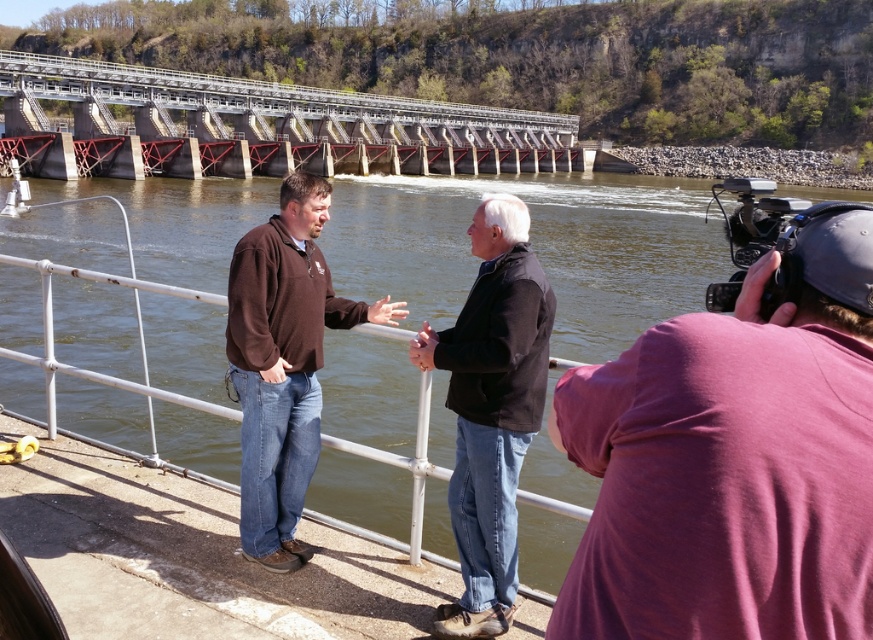
You are a photographer trying to capture a portrait of both the black matte jacket at center and the brown fleece at center. Since you want both subjects to be in focus, you need to adjust your camera settings. Considering their heights, which subject should you focus on to ensure both are sharp?

The black matte jacket at center has a lesser height compared to brown fleece at center. To ensure both are in focus, you should focus on the black matte jacket at center since it is closer to the camera, allowing the depth of field to cover the taller brown fleece at center.

You are a construction worker needing to transport materials from the red metal bridge at upper center to the brown fleece at center. Given that your vehicle can only travel 200 feet, can you make the journey without refueling?

The distance between the red metal bridge at upper center and the brown fleece at center is 281.87 feet, which exceeds the vehicle capacity of 200 feet. Therefore, you will need to refuel before completing the journey.

You are a tour guide leading a group near the dam. You need to move from the purple cotton shirt at right to the black matte jacket at center for a demonstration. Can your 1.8 meter long guide pole fit diagonally between them without touching either?

The distance between the purple cotton shirt at right and the black matte jacket at center is 2.94 meters. Since the guide pole is only 1.8 meters long, it can easily fit diagonally between them without touching either object.